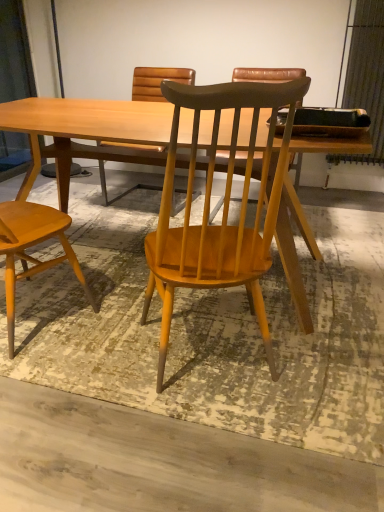
Question: Which is correct: light brown wood chair at left, positioned as the 2th chair in right-to-left order, is inside light wood table at center, or outside of it?

Choices:
 (A) outside
 (B) inside

Answer: (A)

Question: Is light brown wood chair at left, the 1th chair when ordered from left to right, wider or thinner than light wood table at center?

Choices:
 (A) thin
 (B) wide

Answer: (A)

Question: Which of these objects is positioned farthest from the light brown wood chair at left, positioned as the 2th chair in right-to-left order?

Choices:
 (A) wooden chair at center, arranged as the second chair when viewed from the left
 (B) light wood table at center

Answer: (A)

Question: Based on their relative distances, which object is nearer to the wooden chair at center, the first chair in the right-to-left sequence?

Choices:
 (A) light wood table at center
 (B) light brown wood chair at left, the 1th chair when ordered from left to right

Answer: (A)